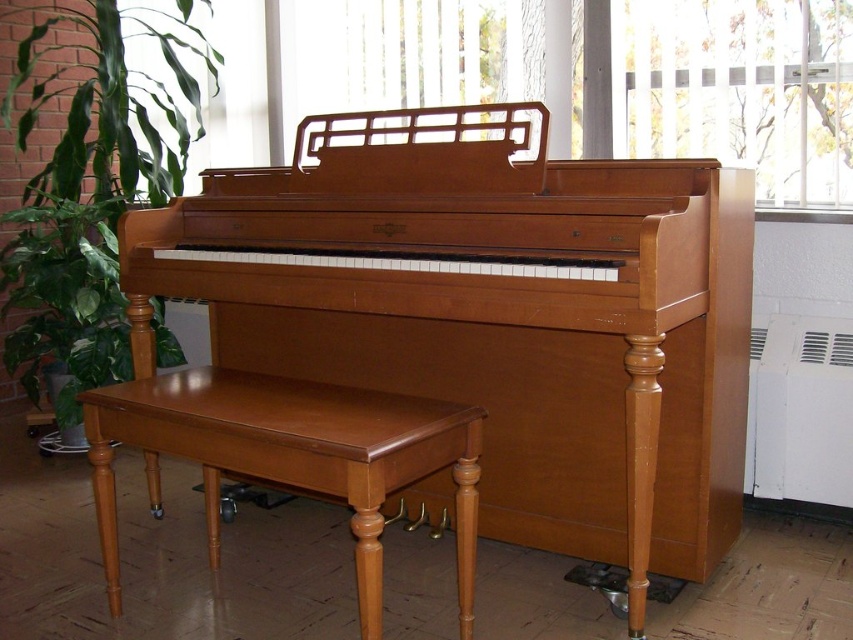
Which of these two, green leafy plant at left or brown leather stool at lower left, stands shorter?

brown leather stool at lower left is shorter.

Is green leafy plant at left closer to camera compared to brown leather stool at lower left?

No, it is behind brown leather stool at lower left.

Where is `green leafy plant at left`? green leafy plant at left is located at coordinates (90, 195).

Which of these two, light brown polished wood piano at center or green leafy plant at left, stands shorter?

light brown polished wood piano at center is shorter.

Does light brown polished wood piano at center have a greater width compared to green leafy plant at left?

Yes.

This screenshot has height=640, width=853. In order to click on light brown polished wood piano at center in this screenshot , I will do `click(494, 314)`.

Is light brown polished wood piano at center positioned before brown leather stool at lower left?

Result: No, light brown polished wood piano at center is further to the viewer.

Does light brown polished wood piano at center have a greater height compared to brown leather stool at lower left?

Yes, light brown polished wood piano at center is taller than brown leather stool at lower left.

Between point (567, 476) and point (318, 438), which one is positioned in front?

Point (318, 438)

Identify the location of light brown polished wood piano at center. This screenshot has height=640, width=853. (494, 314).